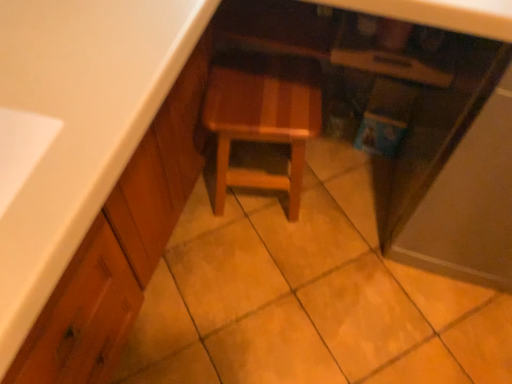
Identify the location of vacant area that lies to the right of wooden stool at center. The height and width of the screenshot is (384, 512). (337, 197).